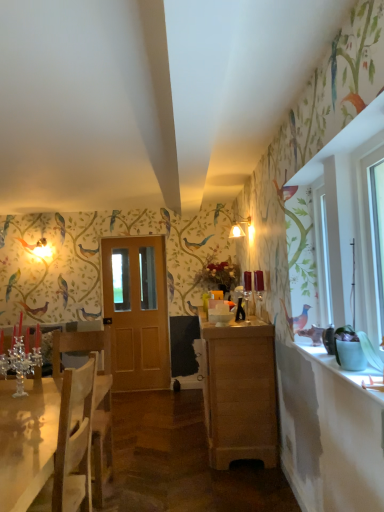
Where is `green matte pot at right`? green matte pot at right is located at coordinates (349, 349).

What is the approximate width of light brown wood cabinet at center?

It is 21.98 inches.

I want to click on shiny wooden table at lower left, so click(x=27, y=440).

Measure the distance between point (6, 395) and camera.

Point (6, 395) is 8.59 feet from camera.

What do you see at coordinates (137, 312) in the screenshot? The height and width of the screenshot is (512, 384). I see `light brown wooden door at center` at bounding box center [137, 312].

What do you see at coordinates (310, 260) in the screenshot? I see `white wood frame at right` at bounding box center [310, 260].

The width and height of the screenshot is (384, 512). What do you see at coordinates (241, 229) in the screenshot?
I see `matte white lampshade at center` at bounding box center [241, 229].

Find the location of a particular element. green matte pot at right is located at coordinates (349, 349).

From the image's perspective, who appears lower, green matte pot at right or white glass window at right?

From the image's view, green matte pot at right is below.

Is the surface of green matte pot at right in direct contact with white glass window at right?

green matte pot at right and white glass window at right are not in contact.

Is green matte pot at right behind white glass window at right?

That is True.

In the scene shown: How different are the orientations of green matte pot at right and white glass window at right in degrees?

green matte pot at right and white glass window at right are facing 0.855 degrees away from each other.

From a real-world perspective, who is located lower, matte white lampshade at center or white glossy counter top at right?

white glossy counter top at right, from a real-world perspective.

Which of these two, matte white lampshade at center or white glossy counter top at right, is thinner?

Thinner between the two is matte white lampshade at center.

Can you tell me how much matte white lampshade at center and white glossy counter top at right differ in facing direction?

matte white lampshade at center and white glossy counter top at right are facing 0.0112 degrees away from each other.

From the image's perspective, which one is positioned higher, matte white lampshade at center or white glossy counter top at right?

matte white lampshade at center is shown above in the image.

Considering the sizes of shiny wooden table at lower left and green matte pot at right in the image, is shiny wooden table at lower left taller or shorter than green matte pot at right?

Clearly, shiny wooden table at lower left is taller compared to green matte pot at right.

How many degrees apart are the facing directions of shiny wooden table at lower left and green matte pot at right?

They differ by 4.54 degrees in their facing directions.

Does point (59, 390) come closer to viewer compared to point (341, 348)?

No, it is behind (341, 348).

From the image's perspective, which one is positioned lower, shiny wooden table at lower left or green matte pot at right?

shiny wooden table at lower left.

Is light brown wood cabinet at center taller or shorter than matte white lampshade at center?

Considering their sizes, light brown wood cabinet at center has more height than matte white lampshade at center.

Is light brown wood cabinet at center far away from matte white lampshade at center?

Yes, light brown wood cabinet at center is far from matte white lampshade at center.

Is light brown wood cabinet at center oriented towards matte white lampshade at center?

No, light brown wood cabinet at center does not turn towards matte white lampshade at center.

Which is behind, point (238, 362) or point (234, 229)?

The point (234, 229) is more distant.

Is point (381, 234) closer to viewer compared to point (357, 368)?

Yes, it is.

Considering the sizes of objects white glass window at right and green matte pot at right in the image provided, who is shorter, white glass window at right or green matte pot at right?

green matte pot at right is shorter.

Considering the sizes of white glass window at right and green matte pot at right in the image, is white glass window at right bigger or smaller than green matte pot at right?

Clearly, white glass window at right is larger in size than green matte pot at right.

How many degrees apart are the facing directions of white glass window at right and green matte pot at right?

Answer: The angle between the facing direction of white glass window at right and the facing direction of green matte pot at right is 0.855 degrees.

Is white glass window at right to the left of shiny wooden table at lower left from the viewer's perspective?

No, white glass window at right is not to the left of shiny wooden table at lower left.

Where is `window that is on the right side of shiny wooden table at lower left`? window that is on the right side of shiny wooden table at lower left is located at coordinates (371, 242).

From the image's perspective, does white glass window at right appear lower than shiny wooden table at lower left?

No, from the image's perspective, white glass window at right is not below shiny wooden table at lower left.

Is white glass window at right situated inside shiny wooden table at lower left or outside?

white glass window at right is spatially situated outside shiny wooden table at lower left.

Who is taller, light brown wood cabinet at center or light brown wooden door at center?

With more height is light brown wooden door at center.

Is light brown wood cabinet at center next to light brown wooden door at center and touching it?

They are not placed beside each other.

Is light brown wood cabinet at center wider than light brown wooden door at center?

Correct, the width of light brown wood cabinet at center exceeds that of light brown wooden door at center.

Can you tell me how much light brown wood cabinet at center and light brown wooden door at center differ in facing direction?

91.2 degrees.

Locate an element on the screen. The image size is (384, 512). houseplant that appears on the left of white glass window at right is located at coordinates (349, 349).

The width and height of the screenshot is (384, 512). I want to click on counter top in front of the matte white lampshade at center, so click(344, 370).

Considering their positions, is white glossy counter top at right positioned further to matte white lampshade at center than light brown wooden door at center?

The object further to matte white lampshade at center is white glossy counter top at right.

Considering their positions, is matte white lampshade at center positioned further to light brown wooden door at center than white wood frame at right?

Based on the image, white wood frame at right appears to be further to light brown wooden door at center.

Looking at the image, which one is located closer to light brown wooden door at center, shiny wooden table at lower left or green matte pot at right?

shiny wooden table at lower left is closer to light brown wooden door at center.

Based on the photo, based on their spatial positions, is light brown wooden door at center or shiny wooden table at lower left closer to green matte pot at right?

Among the two, shiny wooden table at lower left is located nearer to green matte pot at right.

Considering their positions, is light brown wooden door at center positioned further to green matte pot at right than white glossy counter top at right?

Based on the image, light brown wooden door at center appears to be further to green matte pot at right.

From the picture: Estimate the real-world distances between objects in this image. Which object is closer to light brown wood cabinet at center, white glass window at right or white wood frame at right?

white wood frame at right is positioned closer to the anchor light brown wood cabinet at center.

From the picture: Estimate the real-world distances between objects in this image. Which object is further from light brown wood cabinet at center, white wood frame at right or green matte pot at right?

Based on the image, green matte pot at right appears to be further to light brown wood cabinet at center.

Which object lies nearer to the anchor point green matte pot at right, shiny wooden table at lower left or light brown wooden door at center?

shiny wooden table at lower left is closer to green matte pot at right.

At what (x,y) coordinates should I click in order to perform the action: click on cabinetry between white glossy counter top at right and light brown wooden door at center along the z-axis. Please return your answer as a coordinate pair (x, y). This screenshot has width=384, height=512. Looking at the image, I should click on (239, 392).

Find the location of `houseplant between shiny wooden table at lower left and white glossy counter top at right`. houseplant between shiny wooden table at lower left and white glossy counter top at right is located at coordinates (349, 349).

Locate an element on the screen. Image resolution: width=384 pixels, height=512 pixels. lamp between white glossy counter top at right and light brown wooden door at center in the front-back direction is located at coordinates (241, 229).

Locate an element on the screen. houseplant between white glass window at right and matte white lampshade at center in the front-back direction is located at coordinates (349, 349).